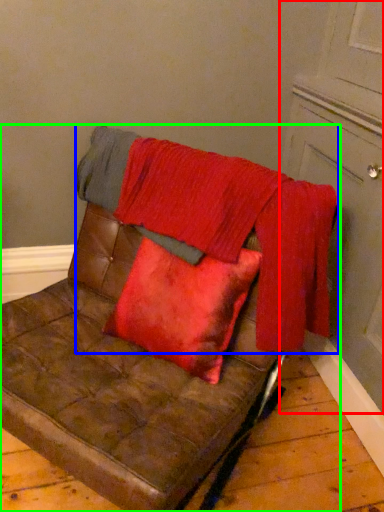
Question: Which object is positioned farthest from door (highlighted by a red box)? Select from blanket (highlighted by a blue box) and furniture (highlighted by a green box).

Choices:
 (A) blanket
 (B) furniture

Answer: (B)